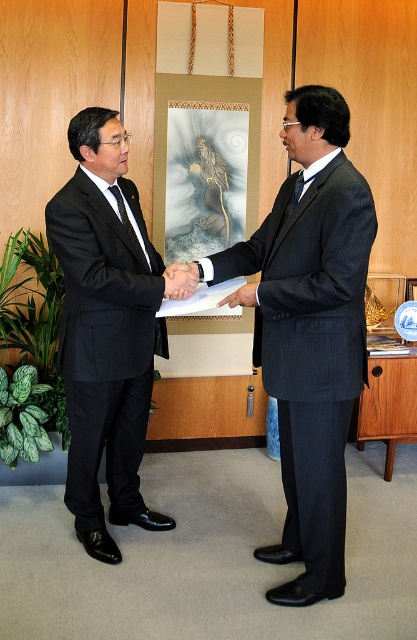
You are a photographer adjusting the camera settings to capture the scene. You notice the matte black tie at left and the matte black hand at center. Which object should you focus on first if you want to ensure the wider object is in sharp focus?

The matte black tie at left is wider than the matte black hand at center, so you should focus on the matte black tie at left first to ensure the wider object is in sharp focus.

You are a photographer taking a picture of the two men shaking hands. You need to ensure that the matte black tie at left and the matte black hand at center are both in focus. Which object should you focus on first to ensure both are sharp?

You should focus on the matte black hand at center first because the matte black tie at left is to the left of it, so focusing on the closer object ensures both are in focus.

You are a photographer setting up for a professional photo shoot in an office. You need to position a spotlight so it illuminates both the dark blue pinstripe suit at center and the matte black tie at left. Which object should you aim the spotlight towards first to ensure both are properly lit?

The dark blue pinstripe suit at center is wider than the matte black tie at left, so you should aim the spotlight towards the dark blue pinstripe suit at center first to cover both areas effectively.